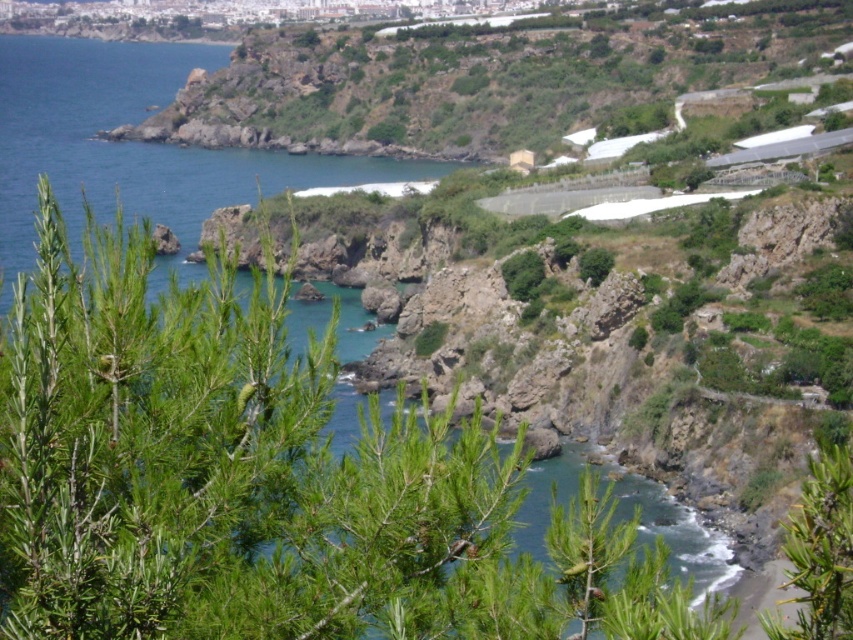
How far apart are green needle-like at center and green needle-like at lower right?

green needle-like at center and green needle-like at lower right are 12.49 meters apart from each other.

Who is lower down, green needle-like at center or green needle-like at lower right?

green needle-like at lower right is lower down.

You are a GUI agent. You are given a task and a screenshot of the screen. Output one action in this format:
    pyautogui.click(x=<x>, y=<y>)
    Task: Click on the green needle-like at center
    
    Given the screenshot: What is the action you would take?
    pyautogui.click(x=265, y=481)

Does green needle-like at center have a lesser height compared to blue water at lower left?

Yes.

Does point (247, 449) come in front of point (161, 92)?

That is True.

Is point (32, 307) closer to viewer compared to point (358, 310)?

Yes, point (32, 307) is in front of point (358, 310).

Where is `green needle-like at center`? The height and width of the screenshot is (640, 853). green needle-like at center is located at coordinates (265, 481).

Does blue water at lower left appear on the left side of green needle-like at lower right?

Indeed, blue water at lower left is positioned on the left side of green needle-like at lower right.

Does blue water at lower left have a larger size compared to green needle-like at lower right?

Indeed, blue water at lower left has a larger size compared to green needle-like at lower right.

Does point (67, 44) come closer to viewer compared to point (795, 531)?

No.

The width and height of the screenshot is (853, 640). I want to click on blue water at lower left, so click(132, 147).